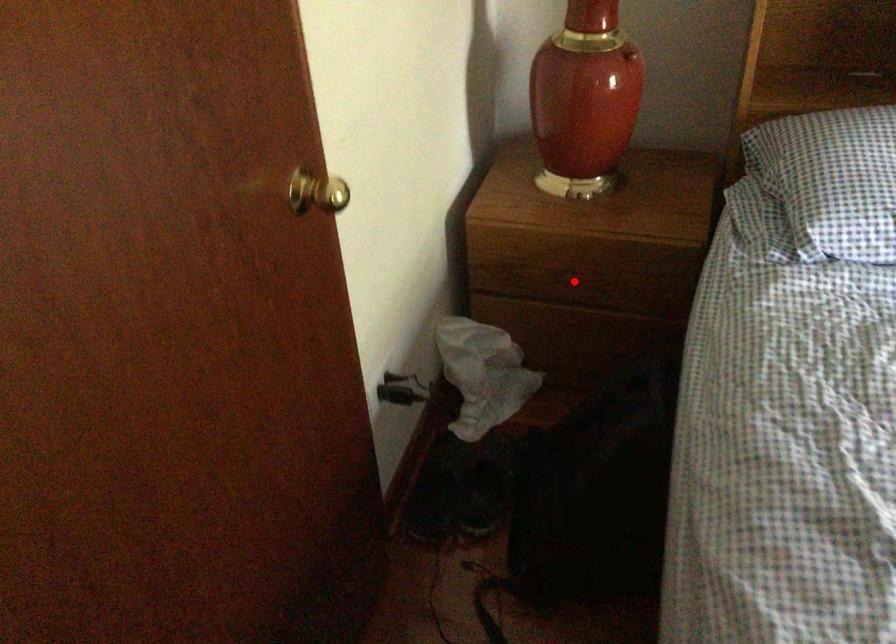
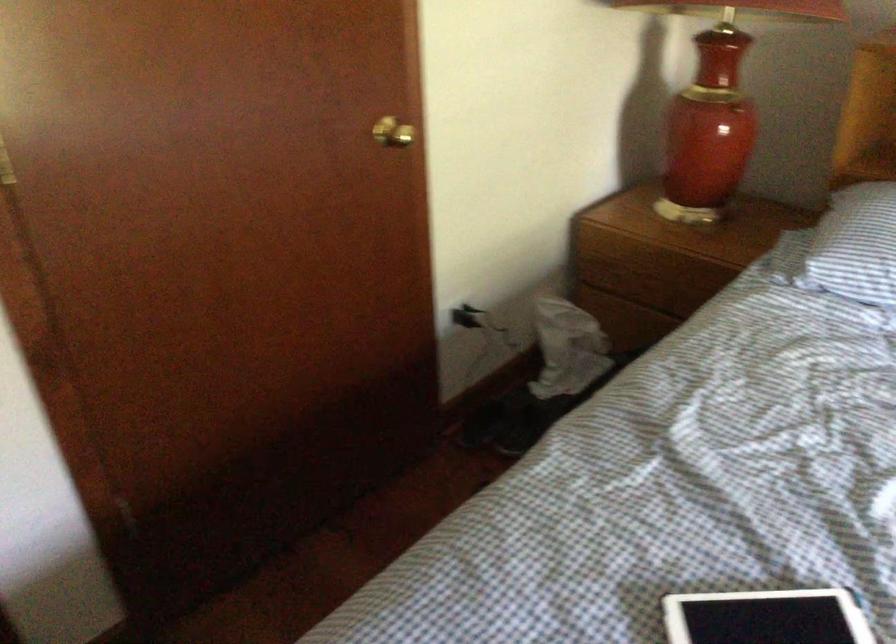
Question: I am providing you with two images of the same scene from different viewpoints. Image1 has a red point marked. In image2, the corresponding 3D location appears at what relative position? Reply with the corresponding letter.

Choices:
 (A) Closer
 (B) Farther

Answer: (B)